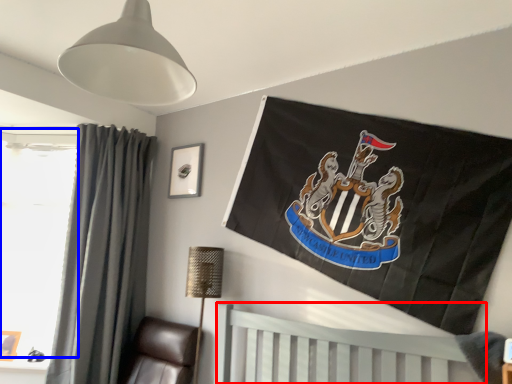
Question: Which object is further to the camera taking this photo, furniture (highlighted by a red box) or window screen (highlighted by a blue box)?

Choices:
 (A) furniture
 (B) window screen

Answer: (B)